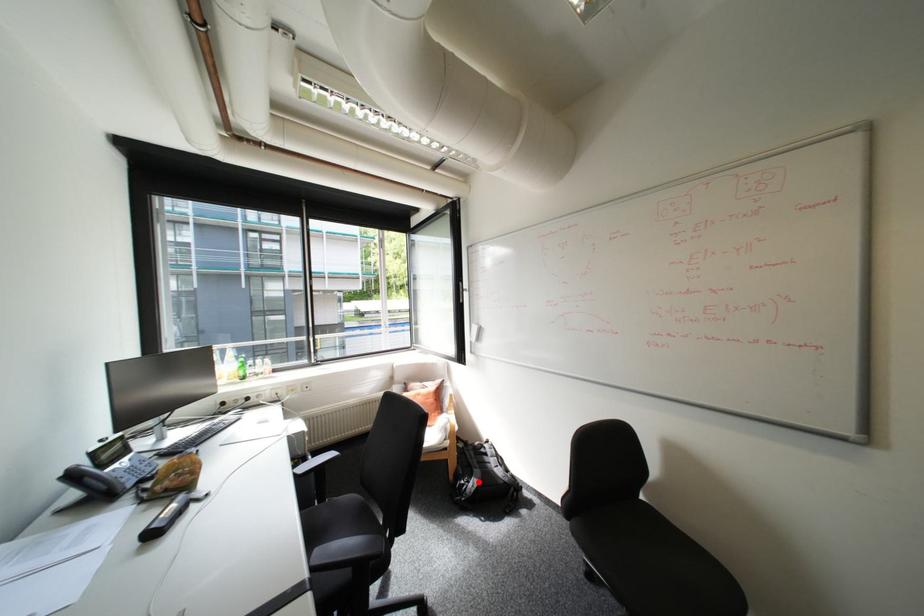
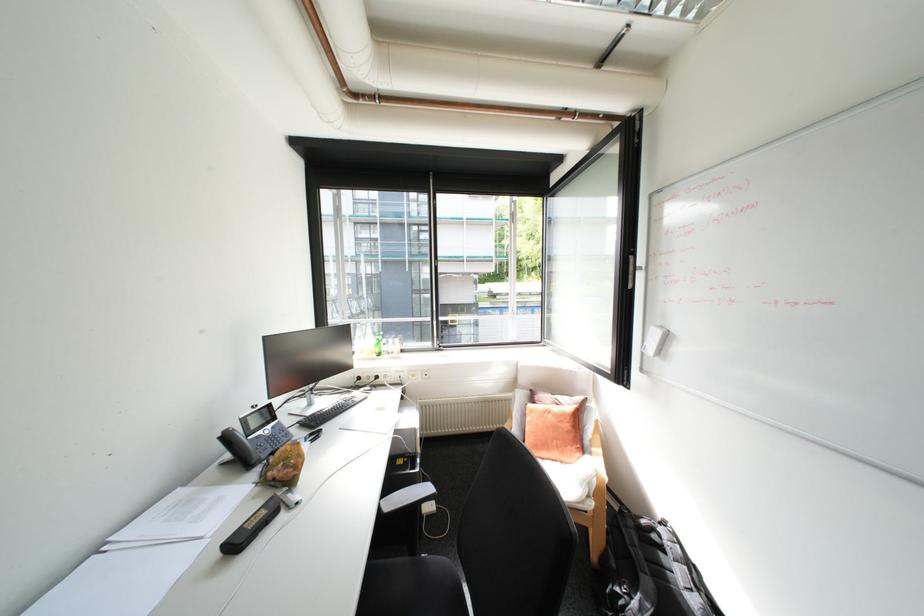
Question: A red point is marked in image1. In image2, is the corresponding 3D point closer to the camera or farther? Reply with the corresponding letter.

Choices:
 (A) The corresponding 3D point is closer.
 (B) The corresponding 3D point is farther.

Answer: (A)